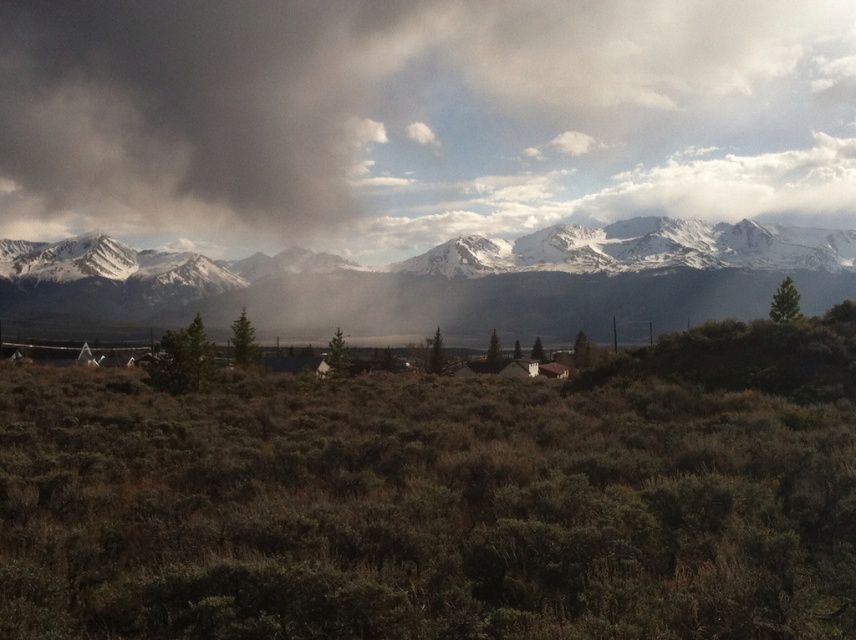
Question: Which object appears closest to the camera in this image?

Choices:
 (A) snowy granite mountain range at upper center
 (B) dark gray cloud at upper center

Answer: (A)

Question: Can you confirm if dark gray cloud at upper center is positioned to the right of snowy granite mountain range at upper center?

Choices:
 (A) yes
 (B) no

Answer: (A)

Question: Can you confirm if dark gray cloud at upper center is thinner than snowy granite mountain range at upper center?

Choices:
 (A) yes
 (B) no

Answer: (B)

Question: Which of the following is the closest to the observer?

Choices:
 (A) (437, 301)
 (B) (497, 17)

Answer: (A)

Question: Which object is farther from the camera taking this photo?

Choices:
 (A) dark gray cloud at upper center
 (B) snowy granite mountain range at upper center

Answer: (A)

Question: Can you confirm if dark gray cloud at upper center is positioned below snowy granite mountain range at upper center?

Choices:
 (A) yes
 (B) no

Answer: (B)